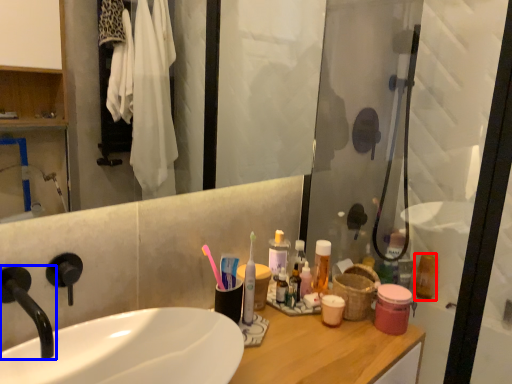
Question: Which point is closer to the camera, mouthwash (highlighted by a red box) or tap (highlighted by a blue box)?

Choices:
 (A) mouthwash
 (B) tap

Answer: (B)